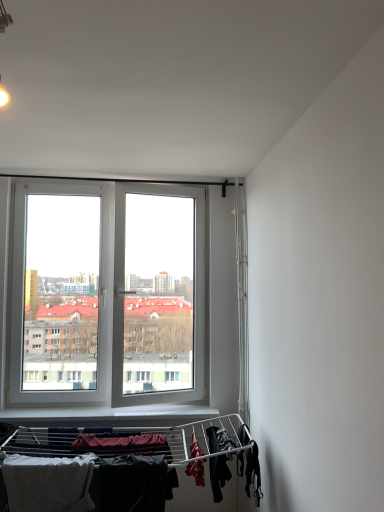
Question: From the image's perspective, is black fabric at lower right, which ranks as the 1th clothing in right-to-left order, under gray cotton towel at lower left, arranged as the first clothing when viewed from the left?

Choices:
 (A) yes
 (B) no

Answer: (B)

Question: Would you say black fabric at lower right, placed as the third clothing when sorted from left to right, is outside gray cotton towel at lower left, the 3th clothing from the right?

Choices:
 (A) yes
 (B) no

Answer: (A)

Question: Is the depth of black fabric at lower right, placed as the third clothing when sorted from left to right, less than that of gray cotton towel at lower left, arranged as the first clothing when viewed from the left?

Choices:
 (A) yes
 (B) no

Answer: (B)

Question: Is black fabric at lower right, which ranks as the 1th clothing in right-to-left order, shorter than gray cotton towel at lower left, arranged as the first clothing when viewed from the left?

Choices:
 (A) no
 (B) yes

Answer: (B)

Question: Does black fabric at lower right, placed as the third clothing when sorted from left to right, have a greater height compared to gray cotton towel at lower left, the 3th clothing from the right?

Choices:
 (A) no
 (B) yes

Answer: (A)

Question: Considering the positions of point (6, 488) and point (235, 445), is point (6, 488) closer or farther from the camera than point (235, 445)?

Choices:
 (A) closer
 (B) farther

Answer: (A)

Question: Is gray cotton towel at lower left, arranged as the first clothing when viewed from the left, in front of or behind black fabric at lower right, which ranks as the 1th clothing in right-to-left order, in the image?

Choices:
 (A) front
 (B) behind

Answer: (A)

Question: Considering the relative positions of gray cotton towel at lower left, the 3th clothing from the right, and black fabric at lower right, placed as the third clothing when sorted from left to right, in the image provided, is gray cotton towel at lower left, the 3th clothing from the right, to the left or to the right of black fabric at lower right, placed as the third clothing when sorted from left to right,?

Choices:
 (A) right
 (B) left

Answer: (B)

Question: Which is correct: gray cotton towel at lower left, the 3th clothing from the right, is inside black fabric at lower right, which ranks as the 1th clothing in right-to-left order, or outside of it?

Choices:
 (A) inside
 (B) outside

Answer: (B)

Question: Considering the positions of point (46, 458) and point (104, 478), is point (46, 458) closer or farther from the camera than point (104, 478)?

Choices:
 (A) closer
 (B) farther

Answer: (A)

Question: From a real-world perspective, is gray cotton towel at lower left, the 3th clothing from the right, above or below dark matte fabric at lower center, which is the 2th clothing from left to right?

Choices:
 (A) below
 (B) above

Answer: (A)

Question: Is gray cotton towel at lower left, the 3th clothing from the right, bigger or smaller than dark matte fabric at lower center, which is the 2th clothing from left to right?

Choices:
 (A) small
 (B) big

Answer: (B)

Question: From their relative heights in the image, would you say gray cotton towel at lower left, the 3th clothing from the right, is taller or shorter than dark matte fabric at lower center, the 2th clothing when ordered from right to left?

Choices:
 (A) short
 (B) tall

Answer: (B)

Question: In terms of width, does black fabric at lower right, which ranks as the 1th clothing in right-to-left order, look wider or thinner when compared to gray cotton towel at lower left, the 3th clothing from the right?

Choices:
 (A) wide
 (B) thin

Answer: (A)

Question: Is black fabric at lower right, which ranks as the 1th clothing in right-to-left order, to the left or to the right of gray cotton towel at lower left, the 3th clothing from the right, in the image?

Choices:
 (A) right
 (B) left

Answer: (A)